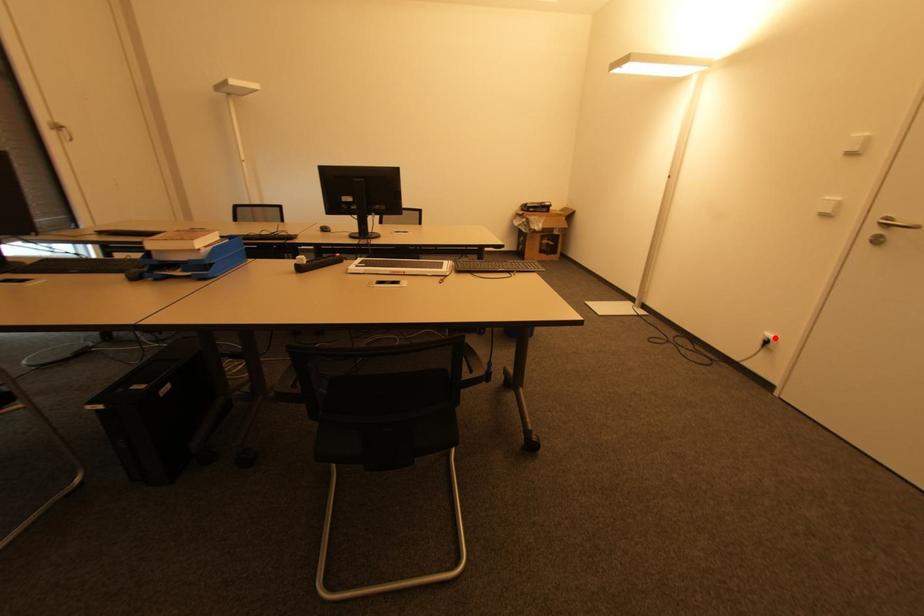
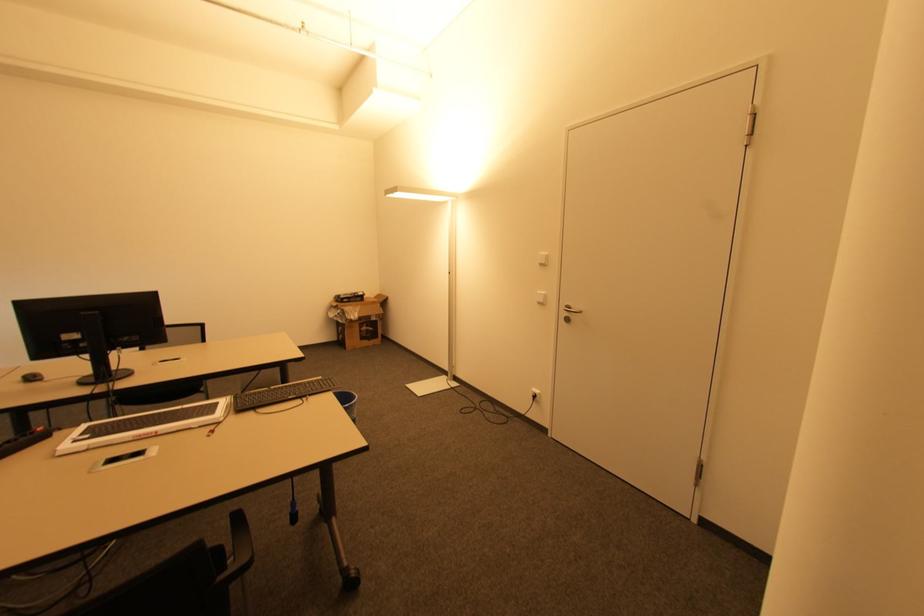
In the second image, find the point that corresponds to the highlighted location in the first image.

(539, 392)